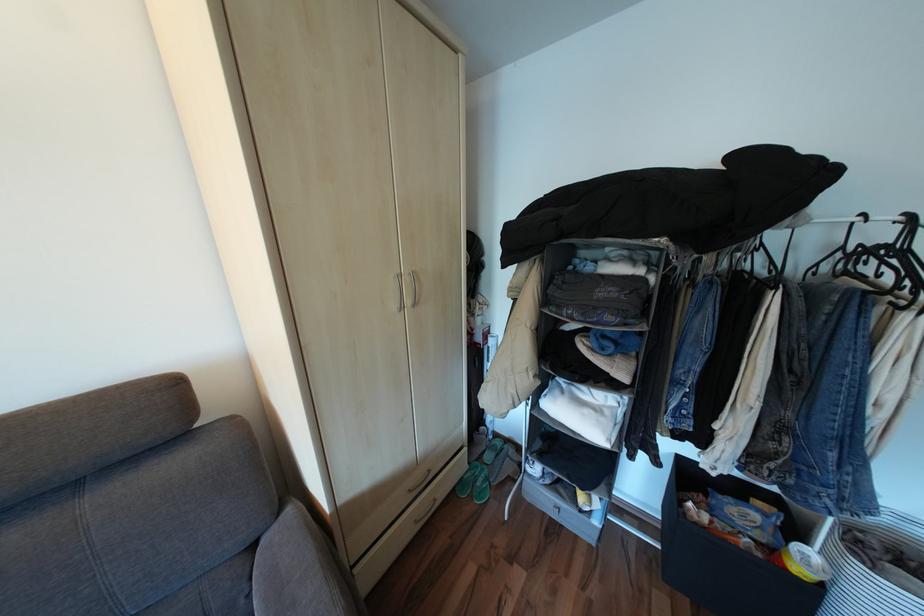
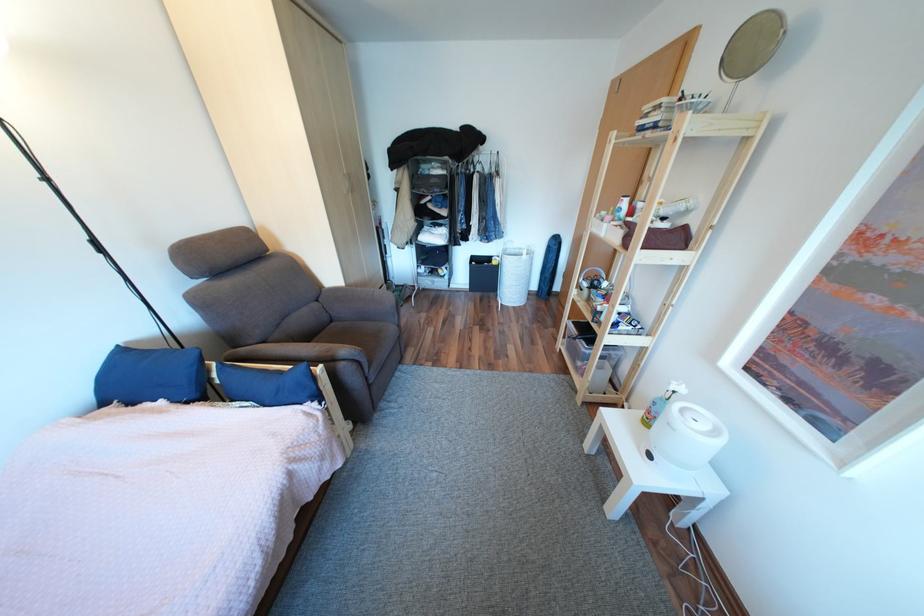
Find the pixel in the second image that matches point (263, 545) in the first image.

(329, 301)